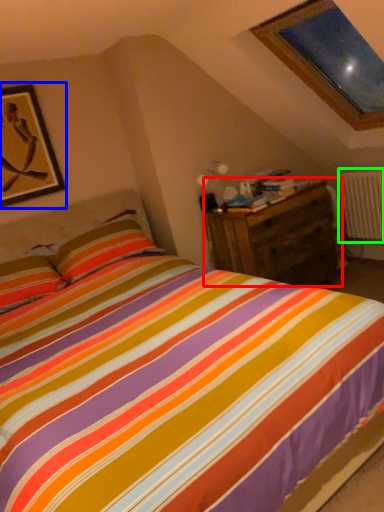
Question: Which object is the closest to the nightstand (highlighted by a red box)? Choose among these: picture frame (highlighted by a blue box) or radiator (highlighted by a green box).

Choices:
 (A) picture frame
 (B) radiator

Answer: (B)